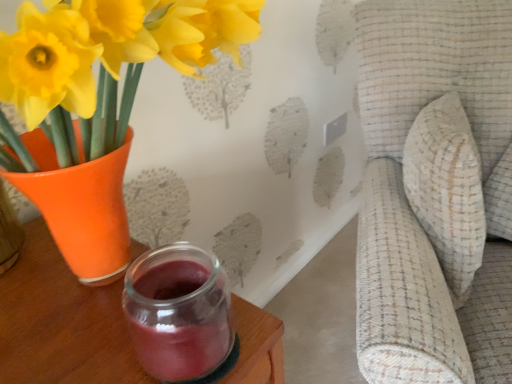
Question: From the image's perspective, is matte orange vase at left above textured beige cushion at right?

Choices:
 (A) yes
 (B) no

Answer: (A)

Question: Does matte orange vase at left appear on the right side of textured beige cushion at right?

Choices:
 (A) yes
 (B) no

Answer: (B)

Question: Considering the relative positions of matte orange vase at left and textured beige cushion at right in the image provided, is matte orange vase at left to the left of textured beige cushion at right from the viewer's perspective?

Choices:
 (A) no
 (B) yes

Answer: (B)

Question: Is matte orange vase at left thinner than textured beige cushion at right?

Choices:
 (A) no
 (B) yes

Answer: (B)

Question: Considering the relative sizes of matte orange vase at left and textured beige cushion at right in the image provided, is matte orange vase at left smaller than textured beige cushion at right?

Choices:
 (A) yes
 (B) no

Answer: (A)

Question: Is matte orange vase at left looking in the opposite direction of textured beige cushion at right?

Choices:
 (A) no
 (B) yes

Answer: (A)

Question: Can you confirm if textured beige cushion at right is positioned to the right of transparent glass jar at lower center?

Choices:
 (A) yes
 (B) no

Answer: (A)

Question: Is textured beige cushion at right wider than transparent glass jar at lower center?

Choices:
 (A) no
 (B) yes

Answer: (B)

Question: Is textured beige cushion at right surrounding transparent glass jar at lower center?

Choices:
 (A) yes
 (B) no

Answer: (B)

Question: Does textured beige cushion at right appear on the left side of transparent glass jar at lower center?

Choices:
 (A) yes
 (B) no

Answer: (B)

Question: From a real-world perspective, is textured beige cushion at right on transparent glass jar at lower center?

Choices:
 (A) yes
 (B) no

Answer: (B)

Question: Is textured beige cushion at right positioned before transparent glass jar at lower center?

Choices:
 (A) yes
 (B) no

Answer: (A)

Question: From a real-world perspective, is textured beige cushion at right over matte orange vase at left?

Choices:
 (A) yes
 (B) no

Answer: (B)